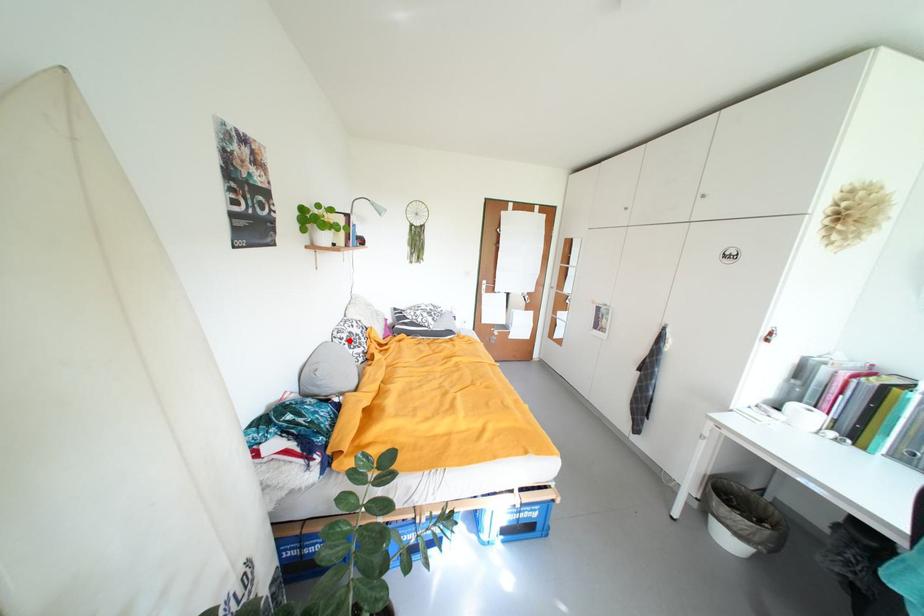
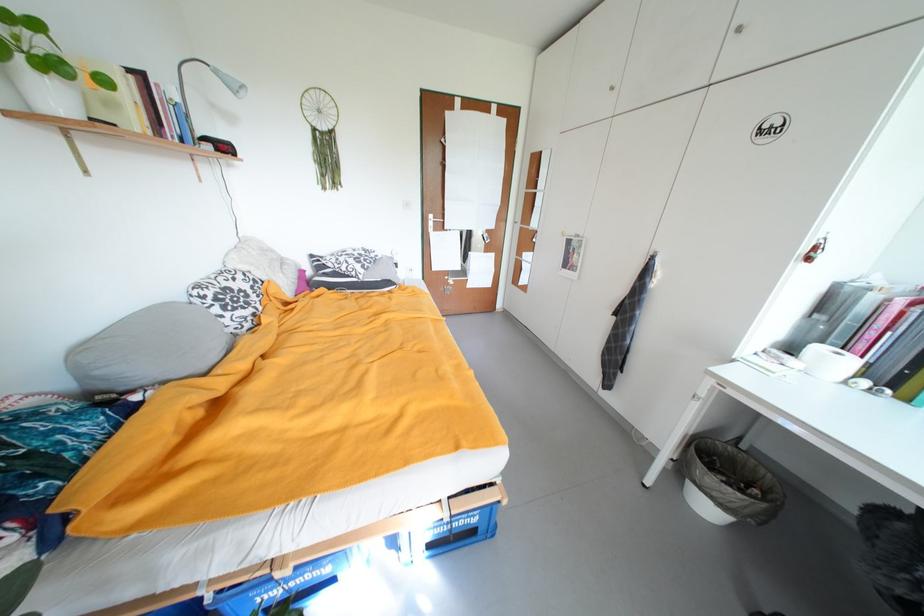
Locate, in the second image, the point that corresponds to the highlighted location in the first image.

(211, 299)